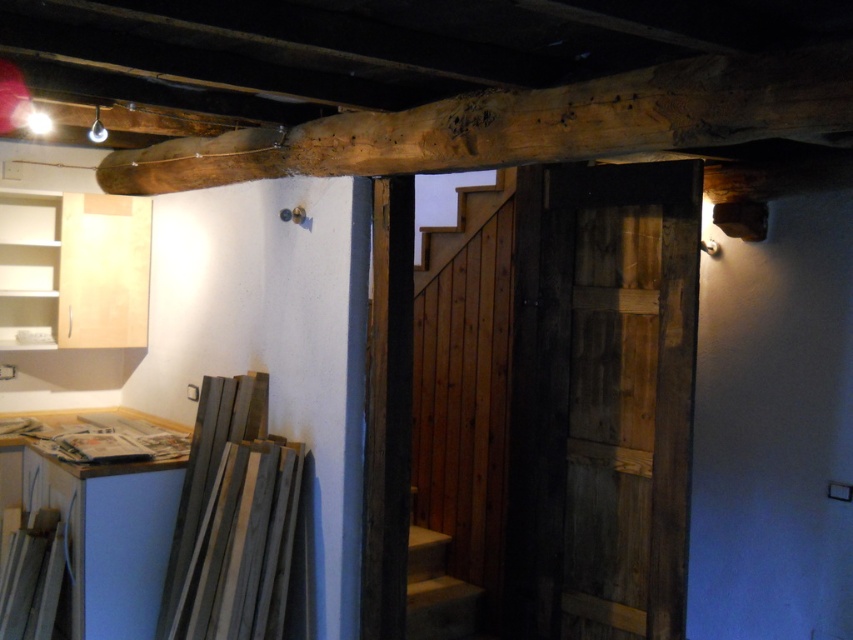
In the scene shown: You are a painter who needs to reach the natural wood beam at upper center to touch it up. You have a ladder that is 1.5 meters tall. The smooth concrete stairs at center are nearby. Can you use the stairs to reach the beam?

The natural wood beam at upper center is much taller than the smooth concrete stairs at center. Since the stairs are shorter, the ladder may not be tall enough to reach the beam when placed on the stairs.

You are standing at the bottom of the smooth concrete stairs at center and want to reach the natural wood beam at upper center. Which direction should you move to get closer to the beam?

You should move upward along the smooth concrete stairs at center to get closer to the natural wood beam at upper center since it is positioned above the stairs.

You are standing at the entrance of the workshop and notice two features in the image. The gray matte wood at lower left and the smooth concrete stairs at center. Which one is positioned to the left side of the other?

The gray matte wood at lower left is to the left of smooth concrete stairs at center.